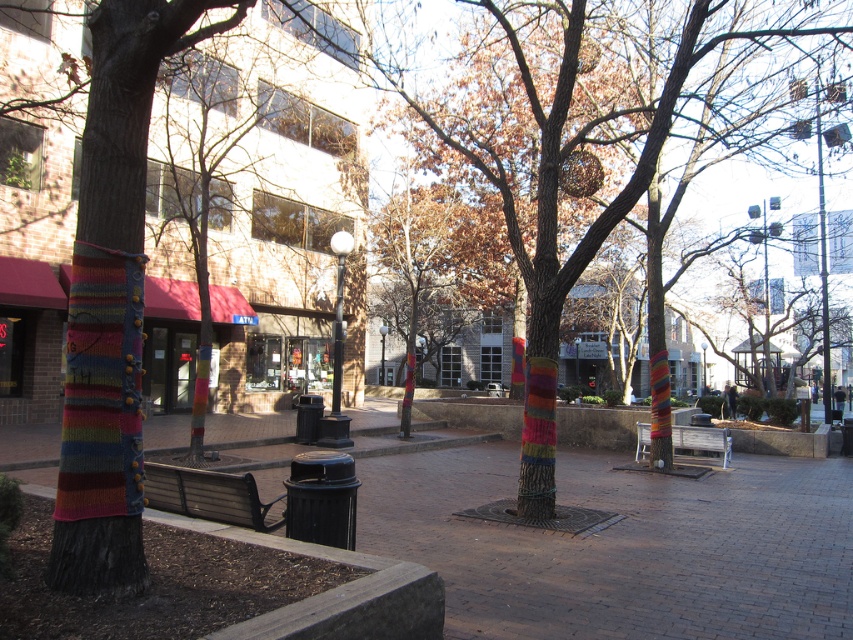
Who is higher up, brick pavement at center or wooden park bench at center?

wooden park bench at center is higher up.

Does point (747, 552) come closer to viewer compared to point (699, 428)?

That is True.

Between point (520, 556) and point (706, 440), which one is positioned behind?

The point (706, 440) is behind.

The image size is (853, 640). I want to click on brick pavement at center, so [624, 545].

Which of these two, brick pavement at center or wooden bench at lower left, stands shorter?

wooden bench at lower left is shorter.

Can you confirm if brick pavement at center is positioned to the left of wooden bench at lower left?

Incorrect, brick pavement at center is not on the left side of wooden bench at lower left.

Who is more distant from viewer, (775, 634) or (257, 515)?

The point (257, 515) is behind.

Where is `brick pavement at center`? The image size is (853, 640). brick pavement at center is located at coordinates (624, 545).

Is wooden bench at lower left to the left of wooden park bench at center from the viewer's perspective?

Indeed, wooden bench at lower left is positioned on the left side of wooden park bench at center.

Between point (221, 497) and point (695, 433), which one is positioned behind?

The point (695, 433) is behind.

Between point (241, 509) and point (727, 444), which one is positioned behind?

The point (727, 444) is behind.

Find the location of `wooden bench at lower left`. wooden bench at lower left is located at coordinates (207, 496).